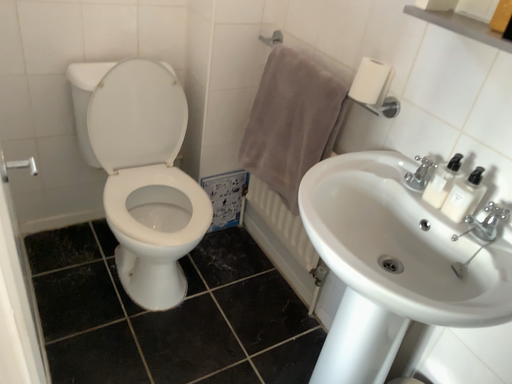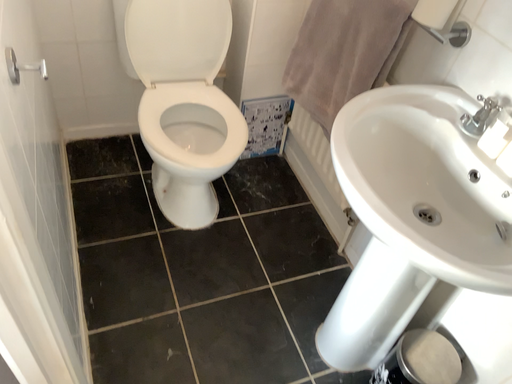
Question: How did the camera likely rotate when shooting the video?

Choices:
 (A) rotated downward
 (B) rotated upward

Answer: (A)